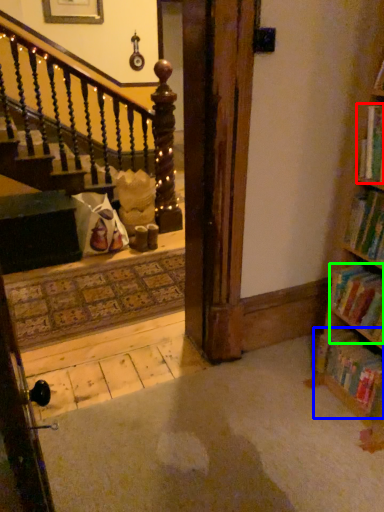
Question: Which object is positioned closest to book (highlighted by a red box)? Select from book (highlighted by a blue box) and book (highlighted by a green box).

Choices:
 (A) book
 (B) book

Answer: (B)